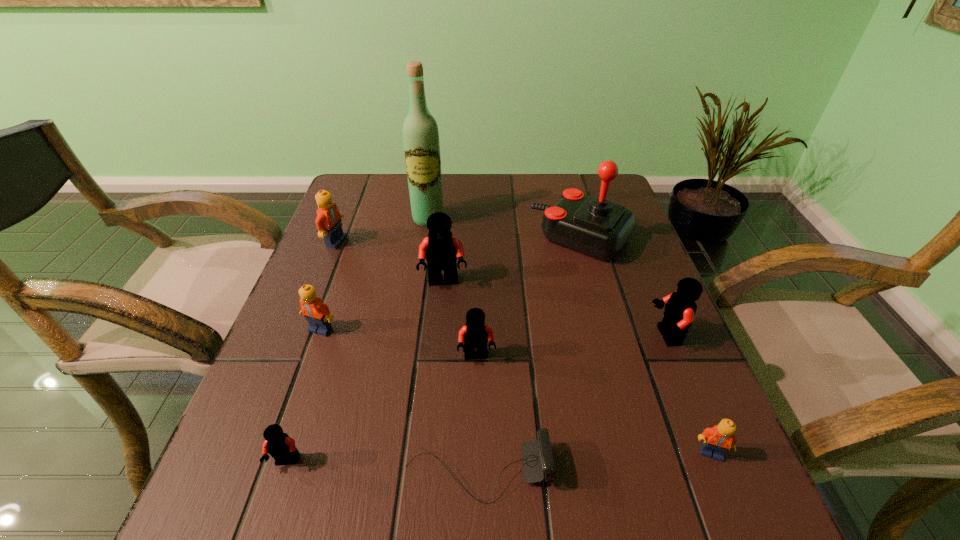
The image size is (960, 540). Find the location of `the third biggest black Lego`. the third biggest black Lego is located at coordinates (475, 334).

Find the location of `the nearest orange Lego`. the nearest orange Lego is located at coordinates (718, 440).

The image size is (960, 540). Identify the location of the smallest orange Lego. (718, 440).

Where is `the nearest black Lego`? the nearest black Lego is located at coordinates 281,447.

In order to click on the smallest black Lego in this screenshot , I will do `click(281, 447)`.

I want to click on the shortest object, so click(x=537, y=459).

At what (x,y) coordinates should I click in order to perform the action: click on vacant area situated 0.210m on the front-facing side of the wine bottle. Please return your answer as a coordinate pair (x, y). Looking at the image, I should click on (419, 282).

This screenshot has width=960, height=540. In order to click on vacant region located 0.330m on the left of the red joystick in this screenshot , I will do `click(405, 238)`.

At what (x,y) coordinates should I click in order to perform the action: click on vacant space located on the front-facing side of the seventh nearest object. Please return your answer as a coordinate pair (x, y). Looking at the image, I should click on (430, 446).

At what (x,y) coordinates should I click in order to perform the action: click on free space located 0.130m on the front-facing side of the biggest orange Lego. Please return your answer as a coordinate pair (x, y). This screenshot has width=960, height=540. Looking at the image, I should click on [396, 242].